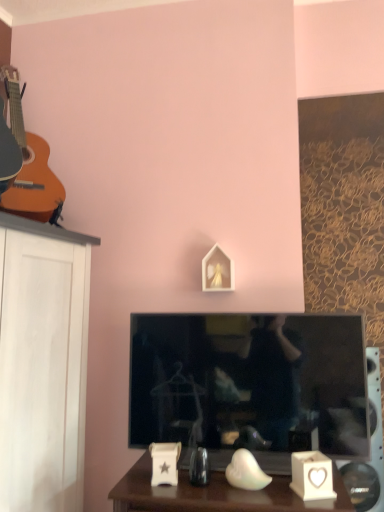
Question: From a real-world perspective, is white ceramic heart-shaped candle holder at lower right above or below white plastic speaker at lower right?

Choices:
 (A) above
 (B) below

Answer: (A)

Question: Considering the positions of point (301, 455) and point (375, 440), is point (301, 455) closer or farther from the camera than point (375, 440)?

Choices:
 (A) farther
 (B) closer

Answer: (B)

Question: Which object is positioned closest to the white plastic speaker at lower right?

Choices:
 (A) white matte picture frame at center
 (B) matte orange acoustic guitar at left
 (C) white ceramic heart-shaped candle holder at lower right
 (D) black glossy television at center

Answer: (D)

Question: Estimate the real-world distances between objects in this image. Which object is farther from the white ceramic heart-shaped candle holder at lower right?

Choices:
 (A) white plastic speaker at lower right
 (B) white matte picture frame at center
 (C) black glossy television at center
 (D) matte orange acoustic guitar at left

Answer: (D)